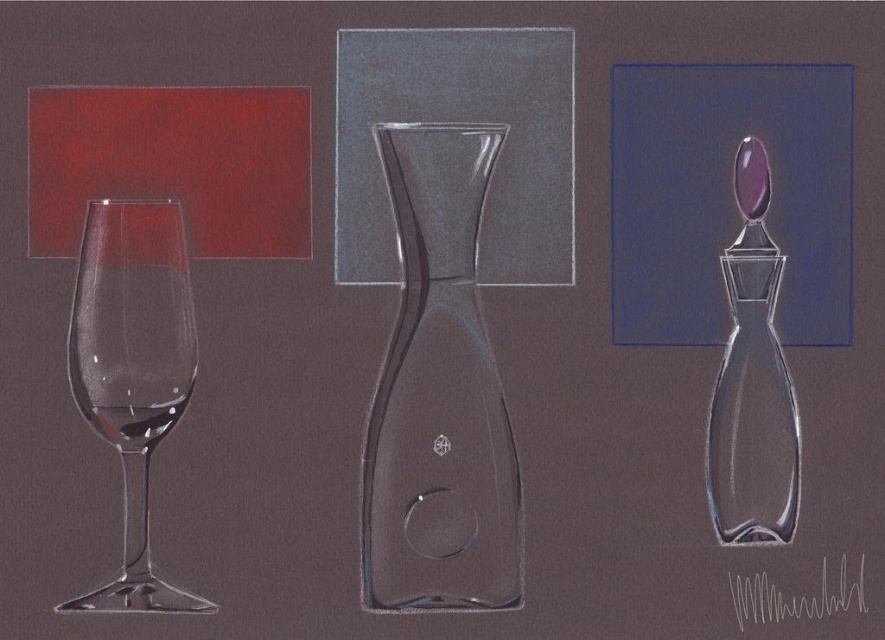
Is transparent glass carafe at center above transparent glass wine at left?

Yes.

Who is more distant from viewer, [447,356] or [167,403]?

The point [447,356] is behind.

You are a GUI agent. You are given a task and a screenshot of the screen. Output one action in this format:
    pyautogui.click(x=<x>, y=<y>)
    Task: Click on the transparent glass carafe at center
    The width and height of the screenshot is (885, 640).
    Given the screenshot: What is the action you would take?
    pyautogui.click(x=439, y=394)

Where is `transparent glass carafe at center`? transparent glass carafe at center is located at coordinates (439, 394).

Is point (756, 234) closer to viewer compared to point (182, 406)?

No, it is not.

Between point (781, 520) and point (89, 404), which one is positioned in front?

Point (89, 404) is in front.

Does point (732, 273) come closer to viewer compared to point (143, 387)?

No, (732, 273) is further to viewer.

This screenshot has height=640, width=885. In order to click on transparent glass bottle at right in this screenshot , I will do `click(750, 364)`.

Based on the photo, can you confirm if transparent glass carafe at center is wider than transparent glass wine glass at left?

Yes, transparent glass carafe at center is wider than transparent glass wine glass at left.

Can you confirm if transparent glass carafe at center is smaller than transparent glass wine glass at left?

Actually, transparent glass carafe at center might be larger than transparent glass wine glass at left.

Locate an element on the screen. The width and height of the screenshot is (885, 640). transparent glass carafe at center is located at coordinates (439, 394).